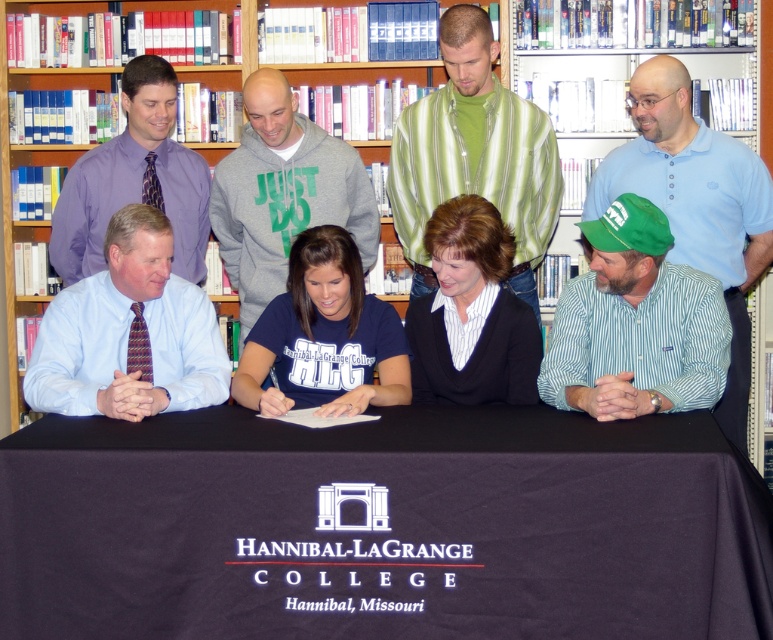
Does green fabric cap at right appear over purple shirt at upper left?

No.

Measure the distance between green fabric cap at right and camera.

They are 3.07 meters apart.

At what (x,y) coordinates should I click in order to perform the action: click on green fabric cap at right. Please return your answer as a coordinate pair (x, y). This screenshot has width=773, height=640. Looking at the image, I should click on (635, 324).

Who is shorter, green fabric cap at right or black sweater at center?

green fabric cap at right is shorter.

What do you see at coordinates (635, 324) in the screenshot?
I see `green fabric cap at right` at bounding box center [635, 324].

Which is behind, point (714, 294) or point (506, 253)?

The point (506, 253) is more distant.

This screenshot has height=640, width=773. Find the location of `green fabric cap at right`. green fabric cap at right is located at coordinates (635, 324).

Is point (152, 122) positioned after point (724, 51)?

No, (152, 122) is closer to viewer.

Is purple shirt at upper left below wooden bookcase at upper center?

Yes.

The height and width of the screenshot is (640, 773). What do you see at coordinates (135, 180) in the screenshot? I see `purple shirt at upper left` at bounding box center [135, 180].

I want to click on purple shirt at upper left, so click(x=135, y=180).